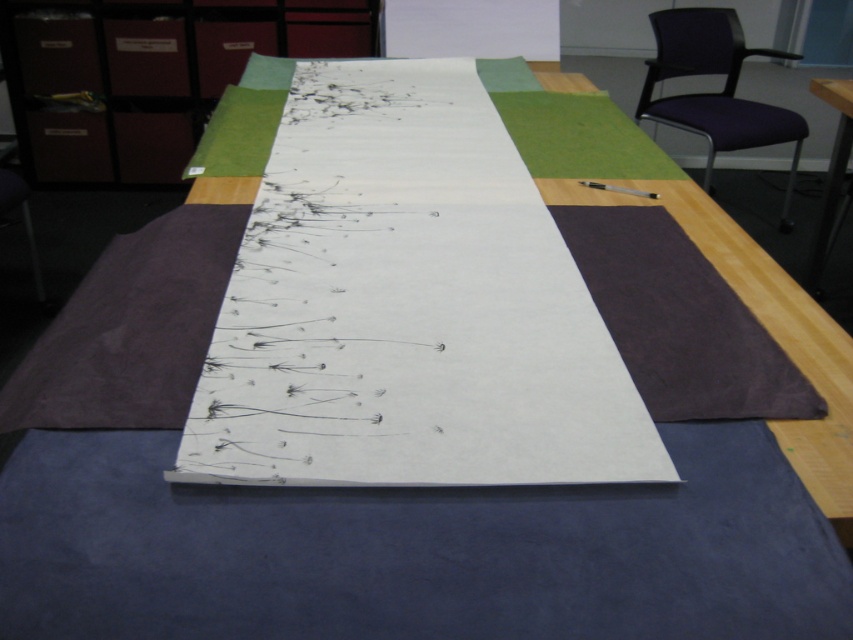
Question: Based on their relative distances, which object is nearer to the purple fabric chair at upper right?

Choices:
 (A) matte brown file cabinet at upper left
 (B) white paper at center
 (C) wooden table at right

Answer: (C)

Question: From the image, what is the correct spatial relationship of white paper at center in relation to purple fabric chair at upper right?

Choices:
 (A) right
 (B) left

Answer: (B)

Question: Which point appears closest to the camera in this image?

Choices:
 (A) (722, 10)
 (B) (141, 38)
 (C) (834, 161)
 (D) (372, 141)

Answer: (D)

Question: Among these objects, which one is farthest from the camera?

Choices:
 (A) matte brown file cabinet at upper left
 (B) purple fabric chair at upper right
 (C) wooden table at right
 (D) white paper at center

Answer: (A)

Question: Does white paper at center appear over matte brown file cabinet at upper left?

Choices:
 (A) yes
 (B) no

Answer: (B)

Question: Is white paper at center behind purple fabric chair at upper right?

Choices:
 (A) yes
 (B) no

Answer: (B)